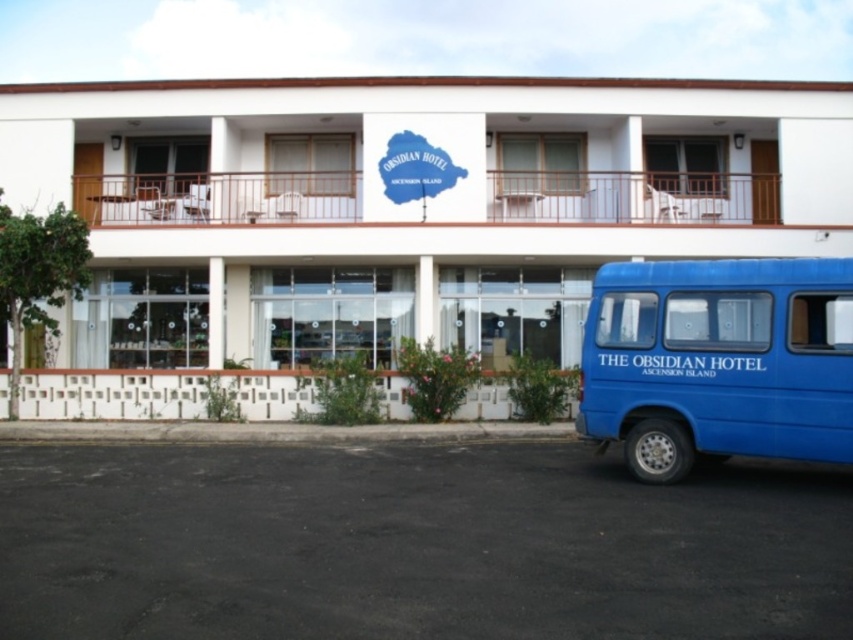
Question: Which object appears farthest from the camera in this image?

Choices:
 (A) blue matte van at lower right
 (B) white matte building at center

Answer: (B)

Question: Is white matte building at center to the right of blue matte van at lower right from the viewer's perspective?

Choices:
 (A) yes
 (B) no

Answer: (B)

Question: Is white matte building at center in front of blue matte van at lower right?

Choices:
 (A) no
 (B) yes

Answer: (A)

Question: Can you confirm if white matte building at center is wider than blue matte van at lower right?

Choices:
 (A) yes
 (B) no

Answer: (A)